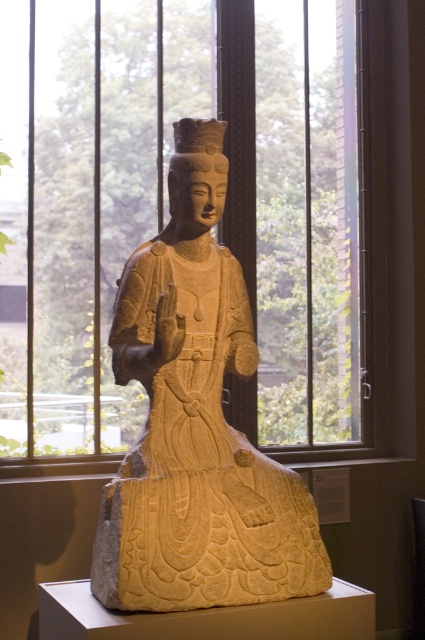
Can you confirm if clear glass window at center is smaller than matte stone statue at center?

No, clear glass window at center is not smaller than matte stone statue at center.

Is point (265, 22) positioned after point (170, 413)?

Yes.

Find the location of a particular element. clear glass window at center is located at coordinates (167, 214).